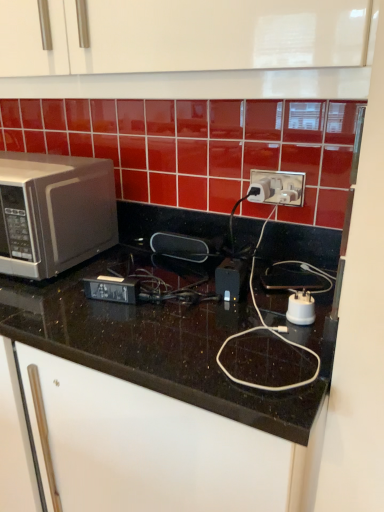
What is the approximate width of satin silver microwave at left?

satin silver microwave at left is 13.72 inches wide.

Measure the distance between point (196, 312) and camera.

35.16 inches.

Describe the element at coordinates (278, 187) in the screenshot. I see `white plastic power plugs and sockets at center` at that location.

The height and width of the screenshot is (512, 384). In order to click on white plastic plug at center, marked as the 1th appliance in a right-to-left arrangement in this screenshot , I will do `click(301, 308)`.

At what (x,y) coordinates should I click in order to perform the action: click on black rubberized speaker at center, the second appliance viewed from the right. Please return your answer as a coordinate pair (x, y). This screenshot has width=384, height=512. Looking at the image, I should click on (179, 247).

From the image's perspective, which object appears higher, satin silver microwave at left or black granite countertop at center?

satin silver microwave at left.

Would you say satin silver microwave at left is inside or outside black granite countertop at center?

satin silver microwave at left exists entirely within black granite countertop at center.

Is satin silver microwave at left directly adjacent to black granite countertop at center?

No, satin silver microwave at left is not with black granite countertop at center.

From their relative heights in the image, would you say satin silver microwave at left is taller or shorter than black granite countertop at center?

In the image, satin silver microwave at left appears to be shorter than black granite countertop at center.

Who is taller, black granite countertop at center or black rubberized speaker at center, positioned as the second appliance in bottom-to-top order?

Standing taller between the two is black granite countertop at center.

Looking at this image, is black granite countertop at center looking in the opposite direction of black rubberized speaker at center, the second appliance viewed from the right?

That's right, black granite countertop at center is facing away from black rubberized speaker at center, the second appliance viewed from the right.

From a real-world perspective, is black granite countertop at center positioned over black rubberized speaker at center, positioned as the second appliance in bottom-to-top order, based on gravity?

No.

Does point (154, 341) come closer to viewer compared to point (164, 238)?

Yes, it is.

From the picture: From the image's perspective, does white plastic power plugs and sockets at center appear lower than white plastic plug at center, marked as the second appliance in a left-to-right arrangement?

Actually, white plastic power plugs and sockets at center appears above white plastic plug at center, marked as the second appliance in a left-to-right arrangement, in the image.

You are a GUI agent. You are given a task and a screenshot of the screen. Output one action in this format:
    pyautogui.click(x=<x>, y=<y>)
    Task: Click on the 2nd appliance located beneath the white plastic power plugs and sockets at center (from a real-world perspective)
    
    Given the screenshot: What is the action you would take?
    pyautogui.click(x=301, y=308)

Does white plastic power plugs and sockets at center have a lesser height compared to white plastic plug at center, arranged as the 1th appliance when viewed from the front?

In fact, white plastic power plugs and sockets at center may be taller than white plastic plug at center, arranged as the 1th appliance when viewed from the front.

Can you tell me how much white plastic power plugs and sockets at center and white plastic plug at center, which appears as the first appliance when ordered from the bottom, differ in facing direction?

7.61 degrees.

Which is behind, satin silver microwave at left or white plastic power plugs and sockets at center?

Positioned behind is white plastic power plugs and sockets at center.

I want to click on power plugs and sockets behind the satin silver microwave at left, so click(278, 187).

From the picture: Can you confirm if satin silver microwave at left is thinner than white plastic power plugs and sockets at center?

Incorrect, the width of satin silver microwave at left is not less than that of white plastic power plugs and sockets at center.

From a real-world perspective, between satin silver microwave at left and white plastic power plugs and sockets at center, who is vertically lower?

satin silver microwave at left is physically lower.

Is point (293, 317) less distant than point (256, 170)?

Yes, point (293, 317) is in front of point (256, 170).

Does white plastic plug at center, which appears as the first appliance when ordered from the bottom, have a smaller size compared to white plastic power plugs and sockets at center?

Yes.

Is white plastic plug at center, the 2th appliance from the top, aimed at white plastic power plugs and sockets at center?

No, white plastic plug at center, the 2th appliance from the top, is not aimed at white plastic power plugs and sockets at center.

How different are the orientations of white plastic plug at center, marked as the 1th appliance in a right-to-left arrangement, and white plastic power plugs and sockets at center in degrees?

The facing directions of white plastic plug at center, marked as the 1th appliance in a right-to-left arrangement, and white plastic power plugs and sockets at center are 7.61 degrees apart.

Where is `countertop located below the satin silver microwave at left (from the image's perspective)`? The width and height of the screenshot is (384, 512). countertop located below the satin silver microwave at left (from the image's perspective) is located at coordinates (163, 343).

Consider the image. Does black granite countertop at center turn towards satin silver microwave at left?

No, black granite countertop at center does not turn towards satin silver microwave at left.

Based on their positions, is black granite countertop at center located to the left or right of satin silver microwave at left?

In the image, black granite countertop at center appears on the right side of satin silver microwave at left.

How many degrees apart are the facing directions of white plastic power plugs and sockets at center and black granite countertop at center?

The angular difference between white plastic power plugs and sockets at center and black granite countertop at center is 0.29 degrees.

Between white plastic power plugs and sockets at center and black granite countertop at center, which one has smaller size?

white plastic power plugs and sockets at center.

Between white plastic power plugs and sockets at center and black granite countertop at center, which one appears on the right side from the viewer's perspective?

white plastic power plugs and sockets at center is more to the right.

From the image's perspective, between white plastic power plugs and sockets at center and black granite countertop at center, which one is located above?

white plastic power plugs and sockets at center.

Locate an element on the screen. The height and width of the screenshot is (512, 384). microwave oven that appears on the left of black granite countertop at center is located at coordinates (54, 212).

From a real-world perspective, count 2nd appliances upward from the black granite countertop at center and point to it. Please provide its 2D coordinates.

[(179, 247)]

Based on their spatial positions, is white plastic plug at center, marked as the 1th appliance in a right-to-left arrangement, or satin silver microwave at left further from black rubberized speaker at center, marked as the first appliance in a top-to-bottom arrangement?

The object further to black rubberized speaker at center, marked as the first appliance in a top-to-bottom arrangement, is white plastic plug at center, marked as the 1th appliance in a right-to-left arrangement.

From the image, which object appears to be farther from black granite countertop at center, white plastic plug at center, which appears as the first appliance when ordered from the bottom, or white plastic power plugs and sockets at center?

white plastic power plugs and sockets at center is positioned further to the anchor black granite countertop at center.

When comparing their distances from white plastic power plugs and sockets at center, does black granite countertop at center or white plastic plug at center, the 2th appliance from the top, seem further?

black granite countertop at center.

When comparing their distances from white plastic plug at center, acting as the 2th appliance starting from the back, does satin silver microwave at left or black rubberized speaker at center, marked as the first appliance in a top-to-bottom arrangement, seem closer?

Answer: The object closer to white plastic plug at center, acting as the 2th appliance starting from the back, is black rubberized speaker at center, marked as the first appliance in a top-to-bottom arrangement.

From the image, which object appears to be farther from white plastic power plugs and sockets at center, white plastic plug at center, marked as the second appliance in a left-to-right arrangement, or black granite countertop at center?

The object further to white plastic power plugs and sockets at center is black granite countertop at center.

Estimate the real-world distances between objects in this image. Which object is further from black rubberized speaker at center, the first appliance positioned from the back, white plastic power plugs and sockets at center or black granite countertop at center?

The object further to black rubberized speaker at center, the first appliance positioned from the back, is black granite countertop at center.

From the image, which object appears to be farther from satin silver microwave at left, black rubberized speaker at center, marked as the first appliance in a top-to-bottom arrangement, or white plastic plug at center, which appears as the first appliance when ordered from the bottom?

Among the two, white plastic plug at center, which appears as the first appliance when ordered from the bottom, is located further to satin silver microwave at left.

From the image, which object appears to be nearer to black rubberized speaker at center, which appears as the 2th appliance when viewed from the front, satin silver microwave at left or black granite countertop at center?

satin silver microwave at left.

This screenshot has width=384, height=512. I want to click on power plugs and sockets located between white plastic plug at center, the 2th appliance from the top, and black rubberized speaker at center, which appears as the 2th appliance when viewed from the front, in the depth direction, so click(278, 187).

Identify the location of countertop between satin silver microwave at left and white plastic plug at center, acting as the 2th appliance starting from the back, in the horizontal direction. (163, 343).

At what (x,y) coordinates should I click in order to perform the action: click on appliance situated between satin silver microwave at left and white plastic plug at center, acting as the 2th appliance starting from the back, from left to right. Please return your answer as a coordinate pair (x, y). Image resolution: width=384 pixels, height=512 pixels. Looking at the image, I should click on (179, 247).

Where is `microwave oven between black granite countertop at center and black rubberized speaker at center, the first appliance positioned from the back, along the z-axis`? The image size is (384, 512). microwave oven between black granite countertop at center and black rubberized speaker at center, the first appliance positioned from the back, along the z-axis is located at coordinates (54, 212).